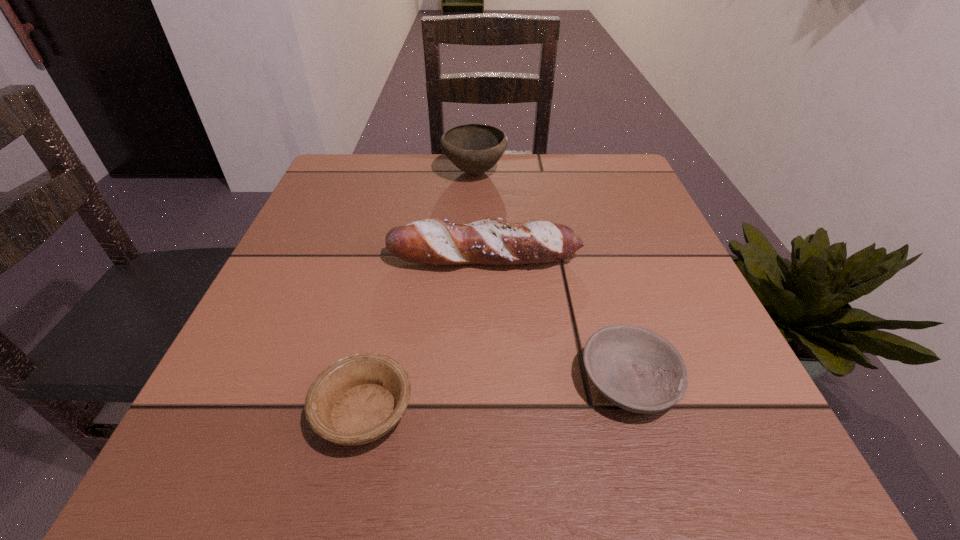
Locate an element on the screen. the farthest object is located at coordinates (474, 148).

At what (x,y) coordinates should I click in order to perform the action: click on the tallest bowl. Please return your answer as a coordinate pair (x, y). The height and width of the screenshot is (540, 960). Looking at the image, I should click on (474, 148).

You are a GUI agent. You are given a task and a screenshot of the screen. Output one action in this format:
    pyautogui.click(x=<x>, y=<y>)
    Task: Click on the baguet
    The image size is (960, 540).
    Given the screenshot: What is the action you would take?
    pyautogui.click(x=488, y=241)

Where is `the second farthest object`? the second farthest object is located at coordinates (488, 241).

Identify the location of the rightmost bowl. The height and width of the screenshot is (540, 960). (636, 369).

Image resolution: width=960 pixels, height=540 pixels. I want to click on blank area located on the front of the tallest object, so click(x=472, y=272).

Where is `free space located on the back of the baguet`? The width and height of the screenshot is (960, 540). free space located on the back of the baguet is located at coordinates (484, 195).

Identify the location of free space located 0.090m on the right of the rightmost bowl. (741, 382).

The height and width of the screenshot is (540, 960). What are the coordinates of `object positioned at the far edge` in the screenshot? It's located at (474, 148).

Where is `object at the near edge`? The image size is (960, 540). object at the near edge is located at coordinates (358, 399).